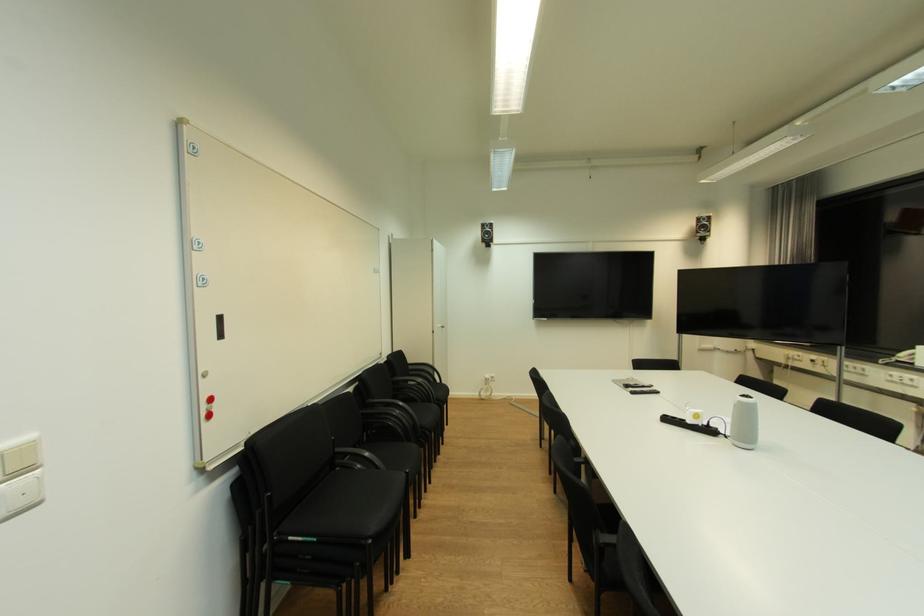
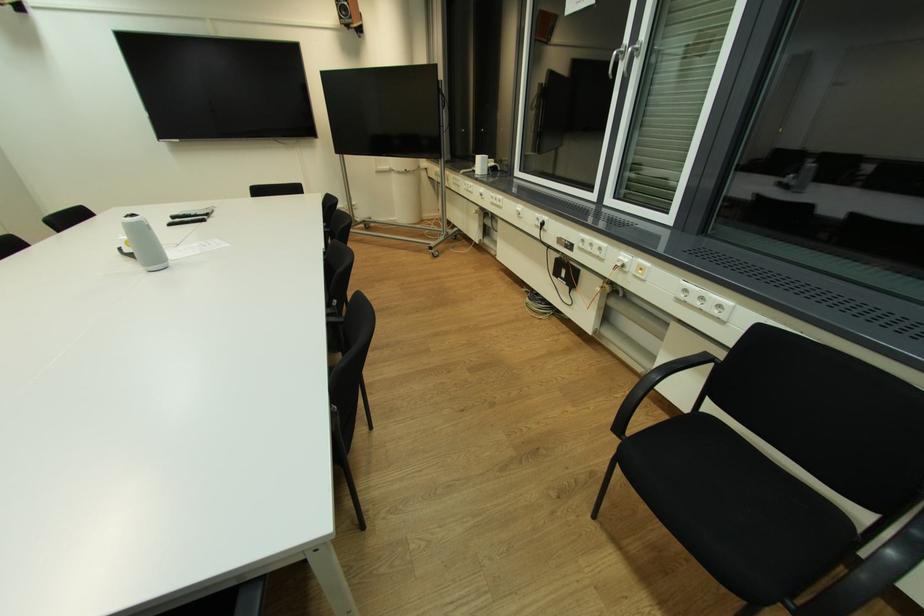
The point at [752,397] is marked in the first image. Where is the corresponding point in the second image?

(137, 216)